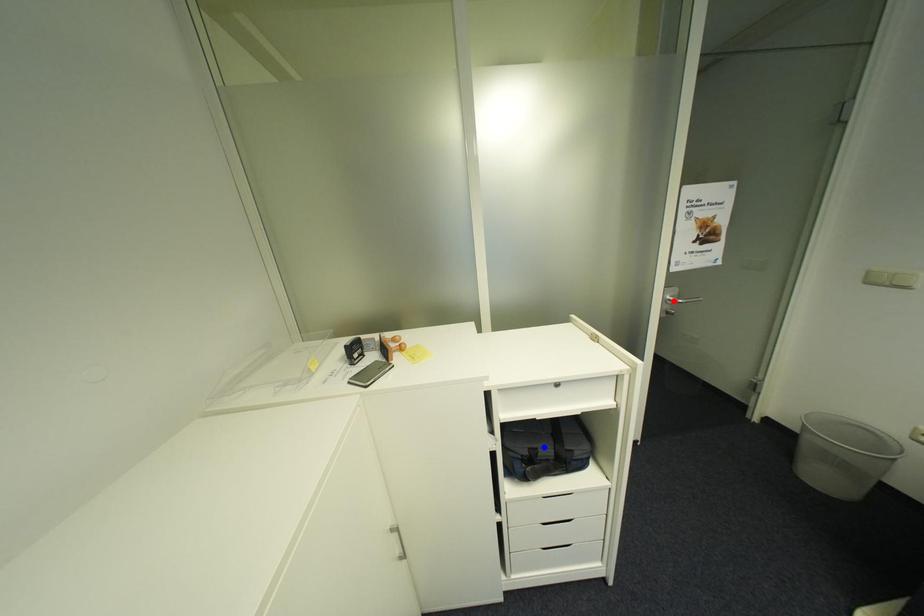
Question: Two points are marked on the image. Which point is closer to the camera?

Choices:
 (A) Blue point is closer.
 (B) Red point is closer.

Answer: (A)